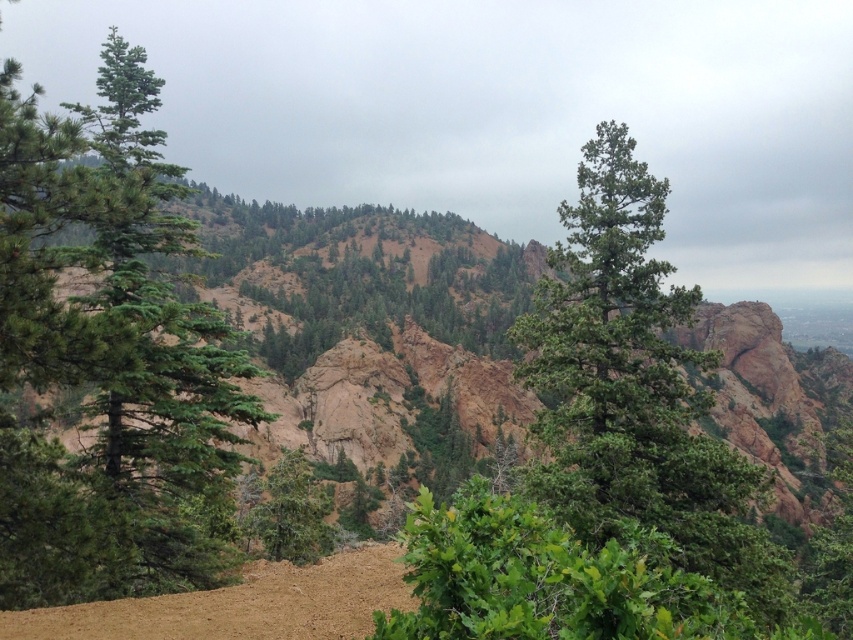
You are a hiker standing in the mountainous landscape and want to take a photo of both the green textured tree at center and the green matte tree at center. Which tree should you position yourself to the left of to capture both in the frame?

You should position yourself to the left of the green matte tree at center because the green textured tree at center is to the right of it, so both will be in the frame.

You are a hiker navigating through the mountainous area. You see a green textured tree at center and a green matte tree at left. Which tree is closer to your left side?

The green matte tree at left is closer to your left side because it is positioned to the left of the green textured tree at center.